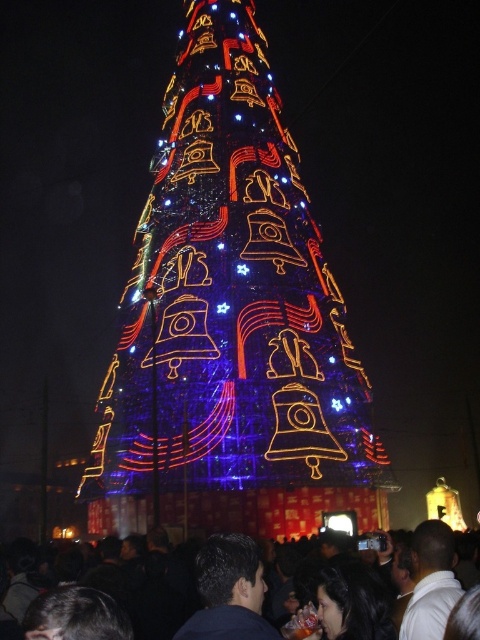
Does illuminated glass christmas tree at center appear on the right side of black matte crowd at lower center?

In fact, illuminated glass christmas tree at center is to the left of black matte crowd at lower center.

Is illuminated glass christmas tree at center to the left of black matte crowd at lower center from the viewer's perspective?

Yes, illuminated glass christmas tree at center is to the left of black matte crowd at lower center.

Is point (254, 282) behind point (196, 596)?

Yes, point (254, 282) is behind point (196, 596).

Identify the location of illuminated glass christmas tree at center. (229, 300).

Does illuminated glass christmas tree at center appear under dark blue fabric at center?

No, illuminated glass christmas tree at center is not below dark blue fabric at center.

Measure the distance between illuminated glass christmas tree at center and camera.

illuminated glass christmas tree at center is 70.02 meters away from camera.

Locate an element on the screen. illuminated glass christmas tree at center is located at coordinates (229, 300).

Can you confirm if black matte crowd at lower center is positioned below dark blue fabric at center?

Indeed, black matte crowd at lower center is positioned under dark blue fabric at center.

Which is below, black matte crowd at lower center or dark blue fabric at center?

black matte crowd at lower center is lower down.

Is point (103, 548) more distant than point (202, 593)?

Yes, it is behind point (202, 593).

At what (x,y) coordinates should I click in order to perform the action: click on black matte crowd at lower center. Please return your answer as a coordinate pair (x, y). This screenshot has height=640, width=480. Looking at the image, I should click on (141, 589).